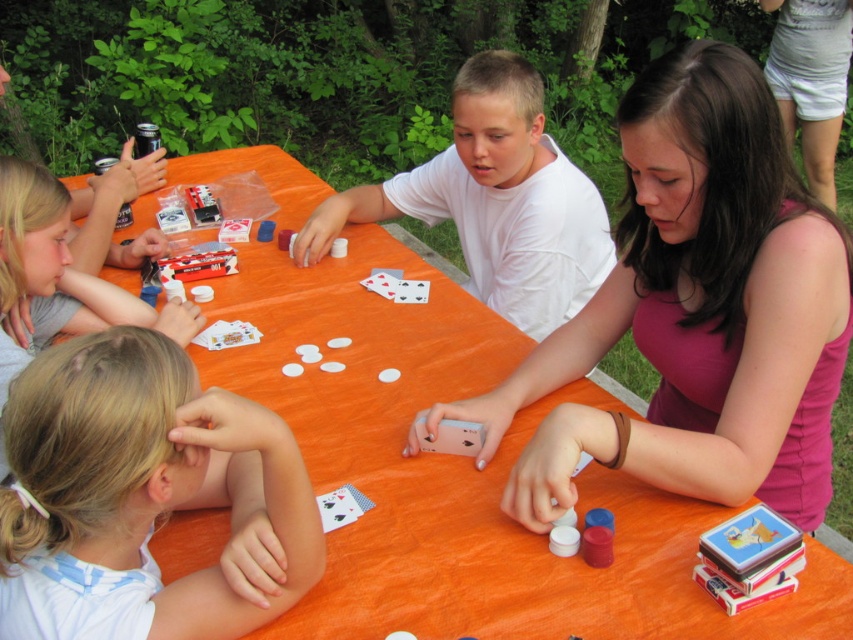
You are a photographer trying to capture the white matte shirt at center in the image. Based on the coordinates provided, where should you focus your camera to ensure the shirt is centered in the frame?

The white matte shirt at center is located at point coordinates (494,200), so you should focus your camera at those coordinates to center the shirt in the frame.

You are a photographer trying to capture the game from the perspective of the white matte shirt at center. To frame the shot, you need to know where the smooth plastic cards at upper left are positioned relative to the shirt. Can you tell me their location?

The smooth plastic cards at upper left are to the left of the white matte shirt at center.